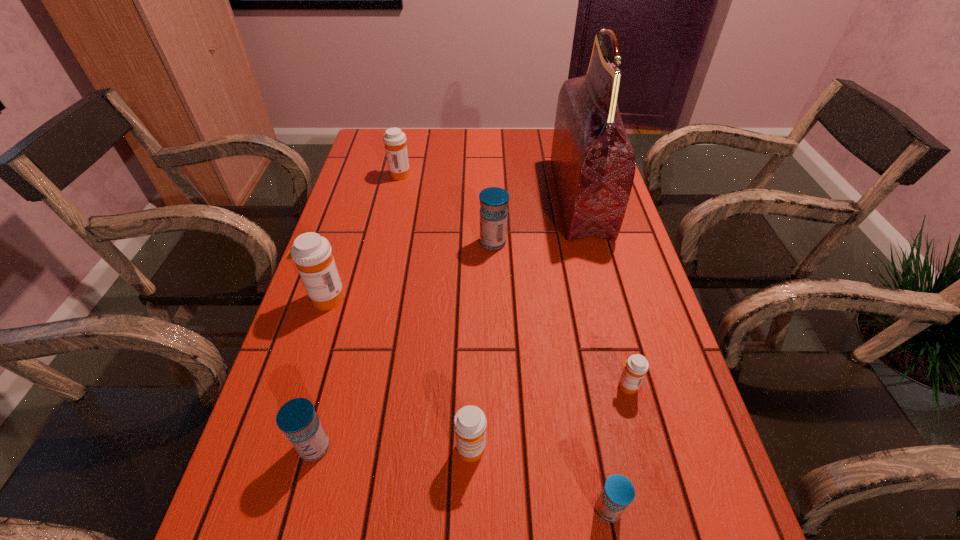
Identify the location of blue medicine that stands as the third closest to the biggest orange medicine. (618, 492).

This screenshot has height=540, width=960. Find the location of `vacant space that satisfies the following two spatial constraints: 1. on the front-facing side of the tallest object; 2. on the front side of the third biggest orange medicine`. vacant space that satisfies the following two spatial constraints: 1. on the front-facing side of the tallest object; 2. on the front side of the third biggest orange medicine is located at coordinates (646, 450).

The image size is (960, 540). Find the location of `free region that satisfies the following two spatial constraints: 1. on the back side of the third orange medicine from right to left; 2. on the right side of the fifth nearest medicine`. free region that satisfies the following two spatial constraints: 1. on the back side of the third orange medicine from right to left; 2. on the right side of the fifth nearest medicine is located at coordinates (366, 174).

Find the location of `vacant space that satisfies the following two spatial constraints: 1. on the back side of the fifth farthest object; 2. on the left side of the smallest blue medicine`. vacant space that satisfies the following two spatial constraints: 1. on the back side of the fifth farthest object; 2. on the left side of the smallest blue medicine is located at coordinates (585, 386).

Where is `vacant region that satisfies the following two spatial constraints: 1. on the back side of the biggest orange medicine; 2. on the left side of the farthest medicine`? Image resolution: width=960 pixels, height=540 pixels. vacant region that satisfies the following two spatial constraints: 1. on the back side of the biggest orange medicine; 2. on the left side of the farthest medicine is located at coordinates (366, 174).